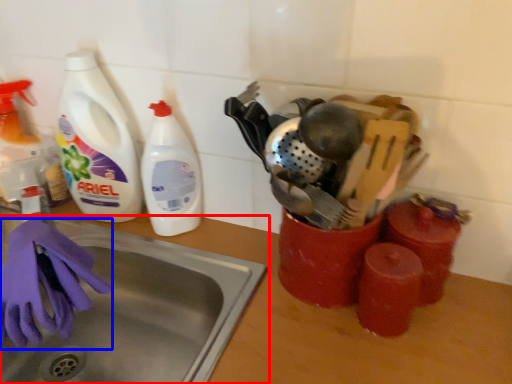
Question: Among these objects, which one is nearest to the camera, sink (highlighted by a red box) or glove (highlighted by a blue box)?

Choices:
 (A) sink
 (B) glove

Answer: (A)